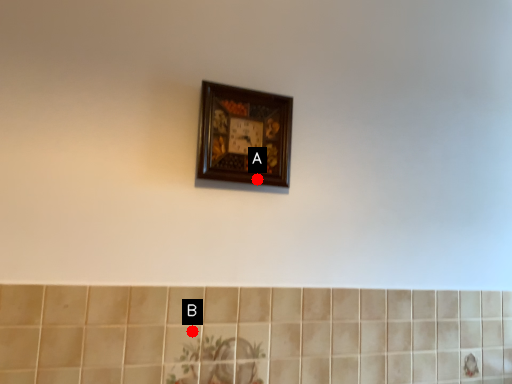
Question: Two points are circled on the image, labeled by A and B beside each circle. Which point is farther from the camera taking this photo?

Choices:
 (A) A is further
 (B) B is further

Answer: (A)